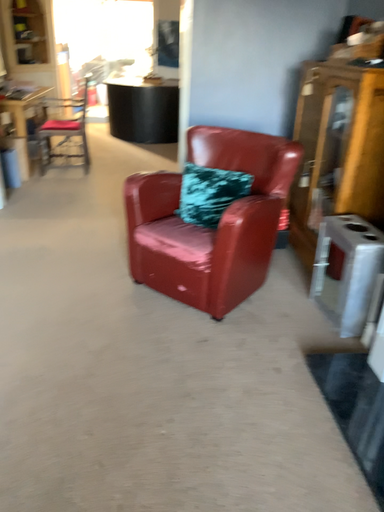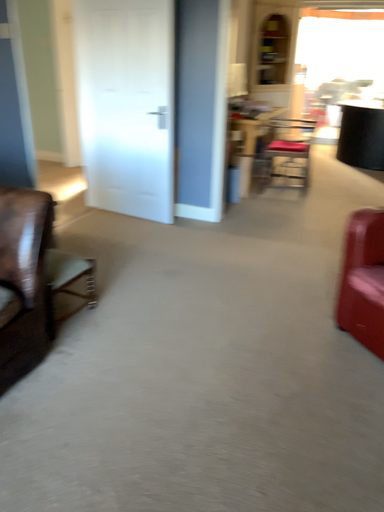
Question: Which way did the camera rotate in the video?

Choices:
 (A) rotated right
 (B) rotated left

Answer: (B)